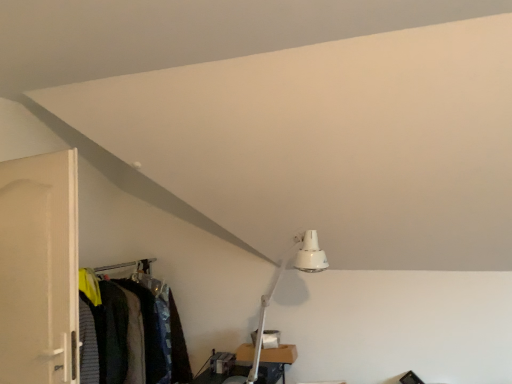
Question: From a real-world perspective, is textured fabric closet at lower left physically located above or below white matte door at left?

Choices:
 (A) above
 (B) below

Answer: (B)

Question: Considering their positions, is textured fabric closet at lower left located in front of or behind white matte door at left?

Choices:
 (A) behind
 (B) front

Answer: (A)

Question: Is textured fabric closet at lower left bigger or smaller than white matte door at left?

Choices:
 (A) small
 (B) big

Answer: (A)

Question: Considering the positions of white matte door at left and textured fabric closet at lower left in the image, is white matte door at left wider or thinner than textured fabric closet at lower left?

Choices:
 (A) thin
 (B) wide

Answer: (A)

Question: From a real-world perspective, is white matte door at left physically located above or below textured fabric closet at lower left?

Choices:
 (A) above
 (B) below

Answer: (A)

Question: In the image, is white matte door at left on the left side or the right side of textured fabric closet at lower left?

Choices:
 (A) right
 (B) left

Answer: (B)

Question: Which is correct: white matte door at left is inside textured fabric closet at lower left, or outside of it?

Choices:
 (A) outside
 (B) inside

Answer: (A)